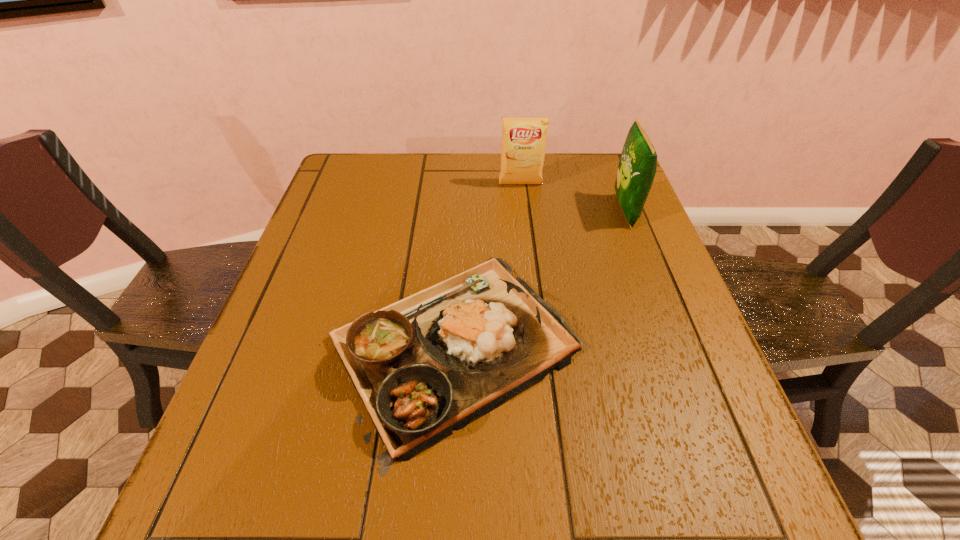
Identify the location of the right crisp (potato chip). The width and height of the screenshot is (960, 540). (637, 167).

This screenshot has height=540, width=960. I want to click on the second nearest object, so click(x=637, y=167).

Image resolution: width=960 pixels, height=540 pixels. Find the location of `the farthest object`. the farthest object is located at coordinates (523, 143).

The height and width of the screenshot is (540, 960). In order to click on the farther crisp (potato chip) in this screenshot , I will do (x=523, y=143).

Locate an element on the screen. The height and width of the screenshot is (540, 960). platter is located at coordinates (426, 365).

Identify the location of the shortest object. (426, 365).

The height and width of the screenshot is (540, 960). In order to click on vacant region located 0.070m on the front-facing side of the second farthest object in this screenshot , I will do `click(588, 211)`.

Locate an element on the screen. This screenshot has width=960, height=540. free spot located 0.300m on the front-facing side of the second farthest object is located at coordinates coord(502,211).

Where is `free space located 0.400m on the front-facing side of the second farthest object`? This screenshot has width=960, height=540. free space located 0.400m on the front-facing side of the second farthest object is located at coordinates (465, 211).

Image resolution: width=960 pixels, height=540 pixels. Find the location of `vacant area situated 0.100m on the front of the farther crisp (potato chip) with the logo`. vacant area situated 0.100m on the front of the farther crisp (potato chip) with the logo is located at coordinates pos(523,210).